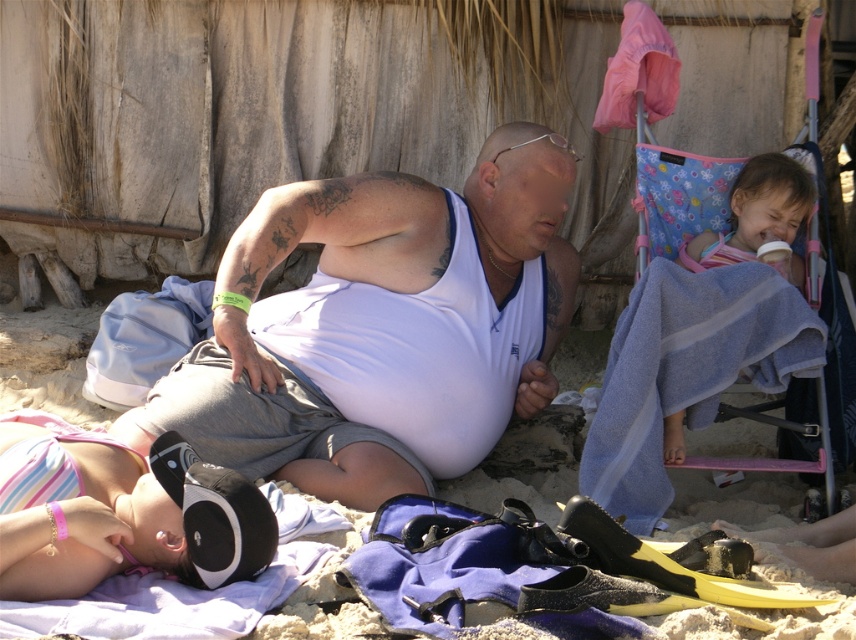
Measure the distance between point (159, 416) and camera.

Answer: Point (159, 416) is 14.98 feet from camera.

This screenshot has width=856, height=640. What do you see at coordinates (382, 324) in the screenshot? I see `white matte tank top at center` at bounding box center [382, 324].

Where is `white matte tank top at center`? white matte tank top at center is located at coordinates (382, 324).

Between pink fabric bikini top at lower left and striped fabric blanket at upper right, which one appears on the right side from the viewer's perspective?

From the viewer's perspective, striped fabric blanket at upper right appears more on the right side.

Which is behind, point (68, 561) or point (742, 198)?

Positioned behind is point (742, 198).

The width and height of the screenshot is (856, 640). I want to click on pink fabric bikini top at lower left, so click(120, 512).

Which of these two, pink fabric bikini top at lower left or white matte towel at upper center, stands shorter?

white matte towel at upper center is shorter.

Is pink fabric bikini top at lower left behind white matte towel at upper center?

Result: Yes, pink fabric bikini top at lower left is behind white matte towel at upper center.

Between point (70, 456) and point (290, 560), which one is positioned in front?

Positioned in front is point (70, 456).

Find the location of a particular element. pink fabric bikini top at lower left is located at coordinates pyautogui.click(x=120, y=512).